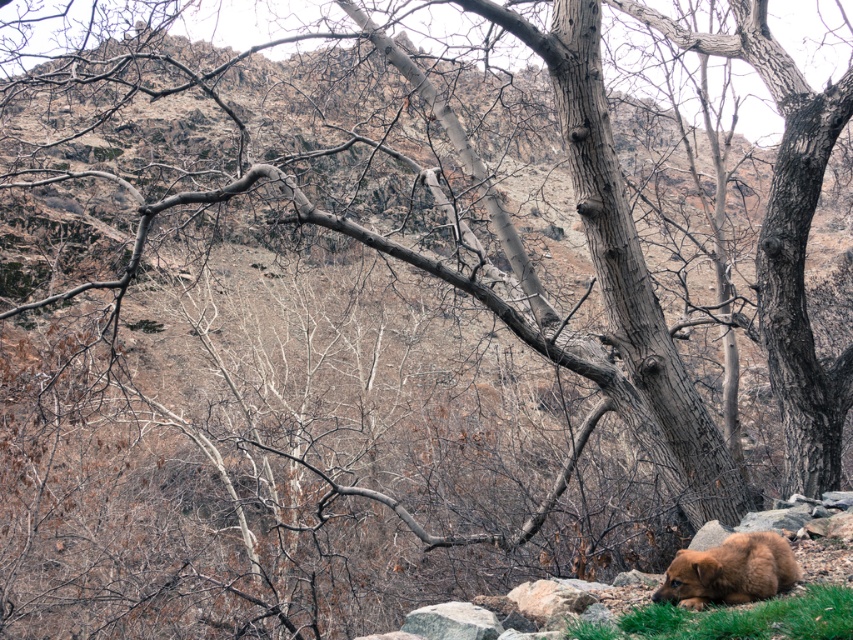
Can you confirm if green soft grass at lower right is shorter than brown furry bear at lower right?

Yes.

Between green soft grass at lower right and brown furry bear at lower right, which one has more height?

Standing taller between the two is brown furry bear at lower right.

This screenshot has width=853, height=640. Find the location of `green soft grass at lower right`. green soft grass at lower right is located at coordinates (737, 620).

Where is `green soft grass at lower right`? The image size is (853, 640). green soft grass at lower right is located at coordinates pyautogui.click(x=737, y=620).